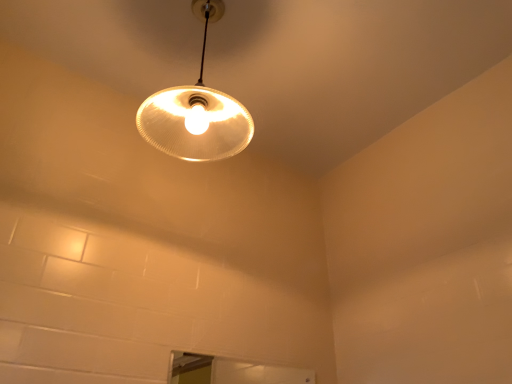
This screenshot has width=512, height=384. Describe the element at coordinates (196, 112) in the screenshot. I see `translucent glass lampshade at upper center` at that location.

You are a GUI agent. You are given a task and a screenshot of the screen. Output one action in this format:
    pyautogui.click(x=<x>, y=<y>)
    Task: Click on the translucent glass lampshade at upper center
    The image size is (512, 384).
    Given the screenshot: What is the action you would take?
    pyautogui.click(x=196, y=112)

This screenshot has width=512, height=384. In order to click on translucent glass lampshade at upper center in this screenshot , I will do `click(196, 112)`.